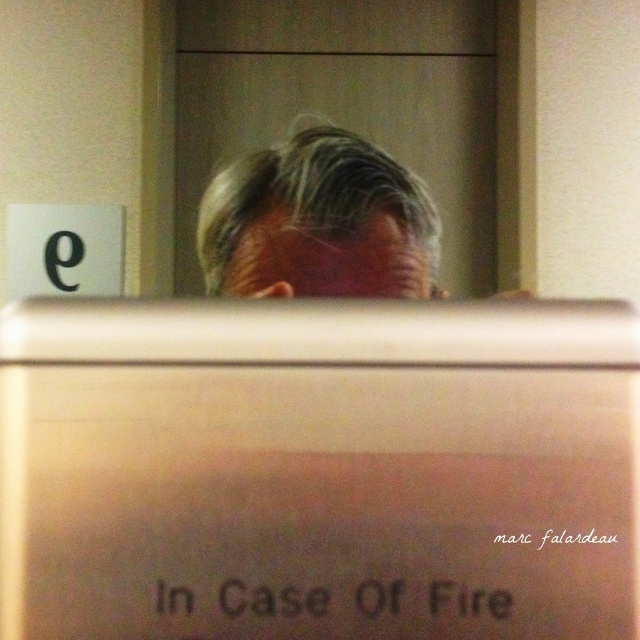
Can you confirm if metallic silver computer screen at center is thinner than gray matte hair at center?

No.

Does point (618, 307) come in front of point (292, 285)?

No, it is behind (292, 285).

You are a GUI agent. You are given a task and a screenshot of the screen. Output one action in this format:
    pyautogui.click(x=<x>, y=<y>)
    Task: Click on the metallic silver computer screen at center
    Image resolution: width=640 pixels, height=640 pixels.
    Given the screenshot: What is the action you would take?
    pyautogui.click(x=317, y=468)